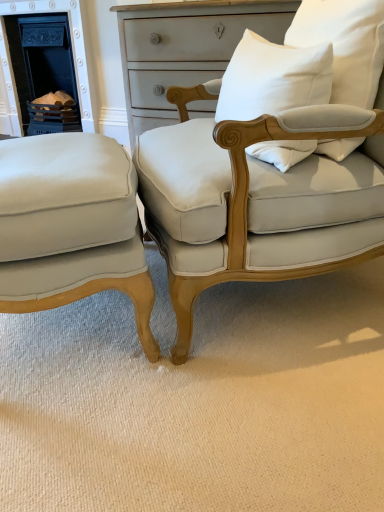
Question: Is matte white fabric chair at center, the first chair from the right, not within white cotton pillow at upper right, marked as the 2th pillow in a right-to-left arrangement?

Choices:
 (A) yes
 (B) no

Answer: (A)

Question: From the image's perspective, is matte white fabric chair at center, marked as the 2th chair in a left-to-right arrangement, above white cotton pillow at upper right, placed as the first pillow when sorted from left to right?

Choices:
 (A) yes
 (B) no

Answer: (B)

Question: Are matte white fabric chair at center, the first chair from the right, and white cotton pillow at upper right, placed as the first pillow when sorted from left to right, located far from each other?

Choices:
 (A) yes
 (B) no

Answer: (B)

Question: From a real-world perspective, is matte white fabric chair at center, the first chair from the right, under white cotton pillow at upper right, placed as the first pillow when sorted from left to right?

Choices:
 (A) no
 (B) yes

Answer: (B)

Question: Is matte white fabric chair at center, the first chair from the right, surrounding white cotton pillow at upper right, marked as the 2th pillow in a right-to-left arrangement?

Choices:
 (A) no
 (B) yes

Answer: (B)

Question: Is matte cream fabric chair at lower left, the 2th chair when ordered from right to left, taller or shorter than matte white fabric chair at center, marked as the 2th chair in a left-to-right arrangement?

Choices:
 (A) short
 (B) tall

Answer: (A)

Question: Considering their positions, is matte cream fabric chair at lower left, the first chair when ordered from left to right, located in front of or behind matte white fabric chair at center, the first chair from the right?

Choices:
 (A) behind
 (B) front

Answer: (A)

Question: Is matte cream fabric chair at lower left, the first chair when ordered from left to right, inside the boundaries of matte white fabric chair at center, the first chair from the right, or outside?

Choices:
 (A) outside
 (B) inside

Answer: (A)

Question: From the image's perspective, is matte cream fabric chair at lower left, the 2th chair when ordered from right to left, positioned above or below matte white fabric chair at center, the first chair from the right?

Choices:
 (A) above
 (B) below

Answer: (B)

Question: Looking at their shapes, would you say matte white fabric chair at center, the first chair from the right, is wider or thinner than white cotton pillow at upper right, marked as the 2th pillow in a right-to-left arrangement?

Choices:
 (A) thin
 (B) wide

Answer: (B)

Question: From their relative heights in the image, would you say matte white fabric chair at center, marked as the 2th chair in a left-to-right arrangement, is taller or shorter than white cotton pillow at upper right, placed as the first pillow when sorted from left to right?

Choices:
 (A) short
 (B) tall

Answer: (B)

Question: From a real-world perspective, is matte white fabric chair at center, the first chair from the right, above or below white cotton pillow at upper right, placed as the first pillow when sorted from left to right?

Choices:
 (A) above
 (B) below

Answer: (B)

Question: Is matte white fabric chair at center, marked as the 2th chair in a left-to-right arrangement, to the left or to the right of white cotton pillow at upper right, placed as the first pillow when sorted from left to right, in the image?

Choices:
 (A) left
 (B) right

Answer: (B)

Question: Would you say matte black fireplace at left is inside or outside white cotton pillow at upper right, placed as the first pillow when sorted from left to right?

Choices:
 (A) outside
 (B) inside

Answer: (A)

Question: Is matte black fireplace at left wider or thinner than white cotton pillow at upper right, placed as the first pillow when sorted from left to right?

Choices:
 (A) wide
 (B) thin

Answer: (A)